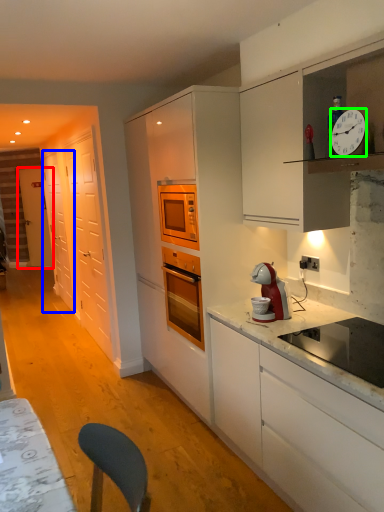
Question: Which is farther away from door (highlighted by a red box)? glass door (highlighted by a blue box) or clock (highlighted by a green box)?

Choices:
 (A) glass door
 (B) clock

Answer: (B)